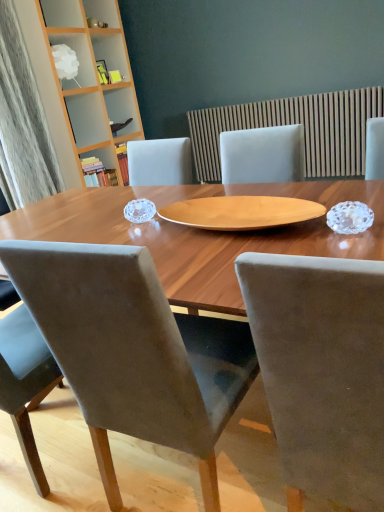
Question: From a real-world perspective, is wooden slats at upper center on velvet grey chair at center, positioned as the second chair in right-to-left order?

Choices:
 (A) no
 (B) yes

Answer: (B)

Question: Considering the relative sizes of wooden slats at upper center and velvet grey chair at center, the 1th chair viewed from the left, in the image provided, is wooden slats at upper center taller than velvet grey chair at center, the 1th chair viewed from the left,?

Choices:
 (A) yes
 (B) no

Answer: (B)

Question: Is velvet grey chair at center, the 1th chair viewed from the left, completely or partially inside wooden slats at upper center?

Choices:
 (A) yes
 (B) no

Answer: (B)

Question: Are wooden slats at upper center and velvet grey chair at center, the 1th chair viewed from the left, located far from each other?

Choices:
 (A) yes
 (B) no

Answer: (A)

Question: Is wooden slats at upper center positioned with its back to velvet grey chair at center, positioned as the second chair in right-to-left order?

Choices:
 (A) yes
 (B) no

Answer: (B)

Question: From the image's perspective, would you say wooden slats at upper center is shown under velvet grey chair at center, positioned as the second chair in right-to-left order?

Choices:
 (A) no
 (B) yes

Answer: (A)

Question: Can you see velvet grey chair at center, the 1th chair viewed from the left, touching white frosted glass lampshade at upper left, the 2th shelf in the bottom-to-top sequence?

Choices:
 (A) yes
 (B) no

Answer: (B)

Question: Can you confirm if velvet grey chair at center, the 1th chair viewed from the left, is wider than white frosted glass lampshade at upper left, the 2th shelf in the bottom-to-top sequence?

Choices:
 (A) no
 (B) yes

Answer: (B)

Question: Does velvet grey chair at center, positioned as the second chair in right-to-left order, appear on the right side of white frosted glass lampshade at upper left, the 2th shelf in the bottom-to-top sequence?

Choices:
 (A) yes
 (B) no

Answer: (A)

Question: Is velvet grey chair at center, positioned as the second chair in right-to-left order, facing away from white frosted glass lampshade at upper left, the 2th shelf in the bottom-to-top sequence?

Choices:
 (A) no
 (B) yes

Answer: (A)

Question: Does velvet grey chair at center, positioned as the second chair in right-to-left order, have a larger size compared to white frosted glass lampshade at upper left, the 2th shelf in the bottom-to-top sequence?

Choices:
 (A) no
 (B) yes

Answer: (B)

Question: From the image's perspective, is velvet grey chair at center, positioned as the second chair in right-to-left order, above white frosted glass lampshade at upper left, the 1th shelf positioned from the top?

Choices:
 (A) yes
 (B) no

Answer: (B)

Question: From a real-world perspective, is white frosted glass lampshade at upper left, the 1th shelf positioned from the top, over wooden slats at upper center?

Choices:
 (A) yes
 (B) no

Answer: (A)